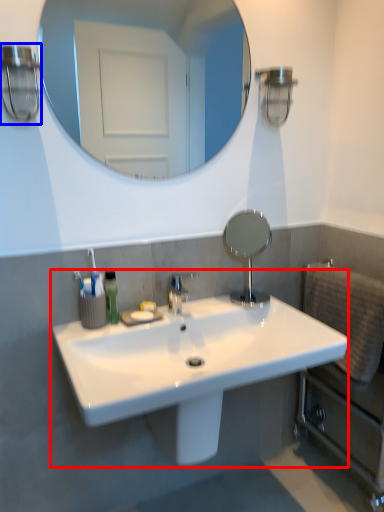
Question: Which point is closer to the camera, sink (highlighted by a red box) or light fixture (highlighted by a blue box)?

Choices:
 (A) sink
 (B) light fixture

Answer: (A)